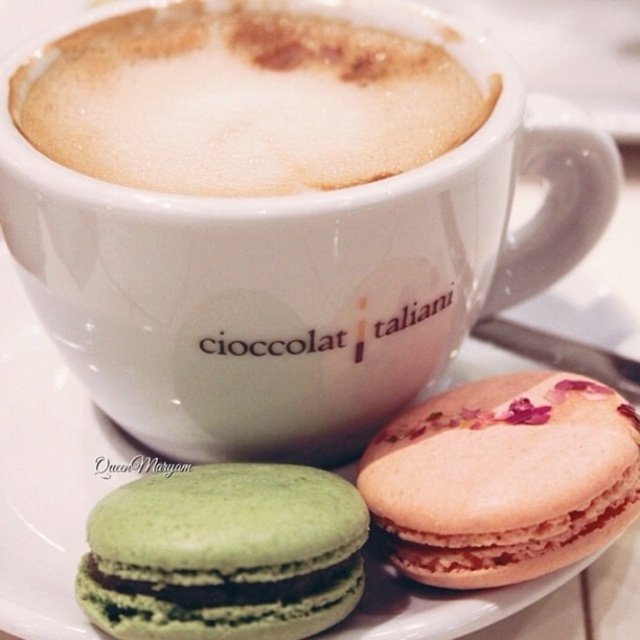
You have a small cookie jar that can only hold items narrower than 5 cm. You need to store both the pink textured macaron at center and the green matte macaron at lower left. Which macaron should you place first into the jar to ensure both fit?

The pink textured macaron at center has a smaller width than the green matte macaron at lower left, so place the pink textured macaron at center first to ensure both fit in the jar.

You are a customer at the Italian chocolate cafe. You want to place your order by pointing to the items on the menu board. The menu board has two points marked as point coordinates. Which point is closer to you, point [113,160] or point [538,392]?

Point [113,160] is in front of point [538,392], so it is closer to you.

You are a food stylist arranging a photo shoot. You need to place a pink textured macaron at center exactly at coordinates 0.748, 0.789. Where should you position it relative to the cup of cappuccino?

The pink textured macaron at center should be positioned at the coordinates (x=504, y=477) relative to the cup of cappuccino.